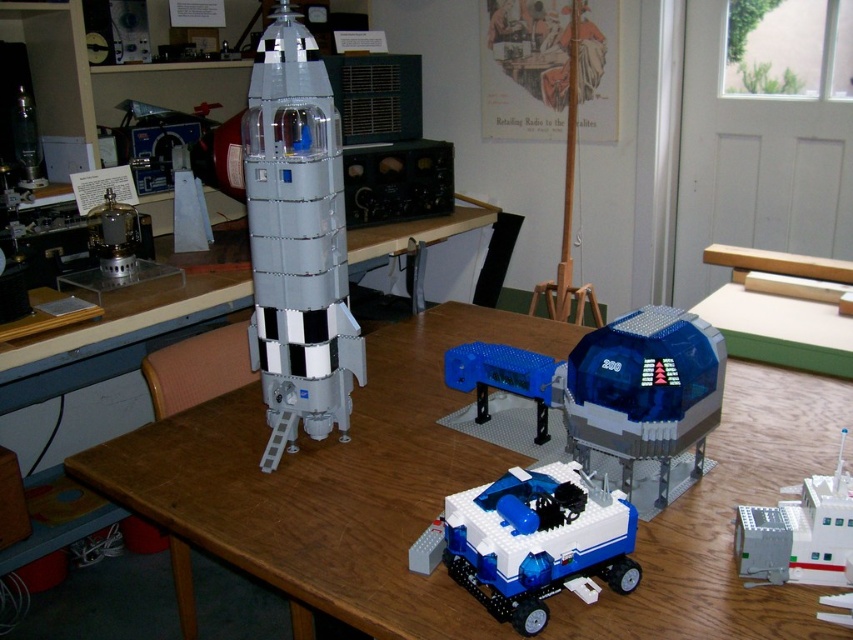
Question: Does wooden table at center appear under transparent blue spaceship at center?

Choices:
 (A) no
 (B) yes

Answer: (B)

Question: Which of the following is the farthest from the observer?

Choices:
 (A) (556, 486)
 (B) (642, 545)
 (C) (759, 566)

Answer: (B)

Question: Is blue plastic rover at center below white plastic building block at lower right?

Choices:
 (A) yes
 (B) no

Answer: (A)

Question: Among these objects, which one is farthest from the camera?

Choices:
 (A) blue plastic rover at center
 (B) transparent blue spaceship at center
 (C) wooden table at center
 (D) blue plastic platform at center

Answer: (D)

Question: From the image, what is the correct spatial relationship of transparent blue spaceship at center in relation to white plastic building block at lower right?

Choices:
 (A) right
 (B) left

Answer: (B)

Question: Estimate the real-world distances between objects in this image. Which object is farther from the translucent plastic rocket at center?

Choices:
 (A) blue plastic rover at center
 (B) white plastic building block at lower right
 (C) wooden table at center
 (D) blue plastic platform at center

Answer: (B)